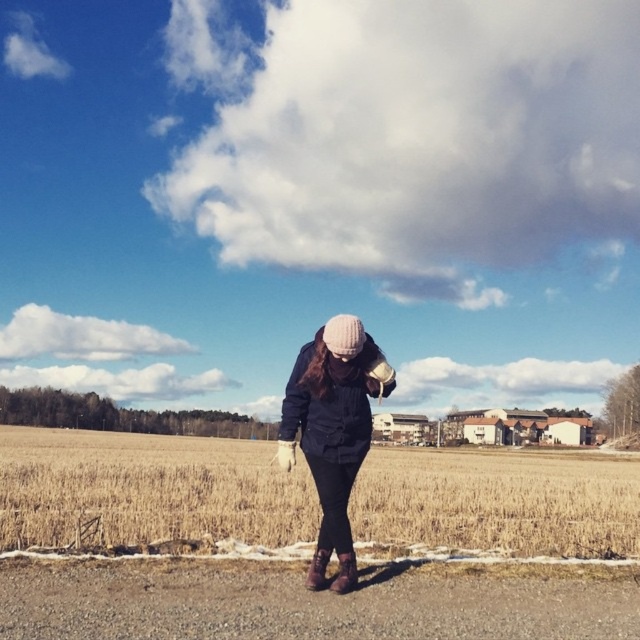
Between brown grass at center and matte black jacket at center, which one is positioned higher?

matte black jacket at center is higher up.

In the scene shown: Is brown grass at center shorter than matte black jacket at center?

Incorrect, brown grass at center's height does not fall short of matte black jacket at center's.

Image resolution: width=640 pixels, height=640 pixels. What do you see at coordinates (147, 490) in the screenshot? I see `brown grass at center` at bounding box center [147, 490].

This screenshot has width=640, height=640. What are the coordinates of `brown grass at center` in the screenshot? It's located at (147, 490).

Is brown grass at center thinner than brown suede boot at lower center?

In fact, brown grass at center might be wider than brown suede boot at lower center.

Is point (216, 477) positioned behind point (337, 589)?

Yes.

Measure the distance between point (499, 468) and camera.

134.57 feet

This screenshot has width=640, height=640. Find the location of `brown grass at center`. brown grass at center is located at coordinates [147, 490].

Does brown suede boot at lower center appear on the left side of brown leather boot at lower center?

No, brown suede boot at lower center is not to the left of brown leather boot at lower center.

Is brown suede boot at lower center further to camera compared to brown leather boot at lower center?

No, brown suede boot at lower center is closer to the viewer.

Who is more forward, [337,576] or [307,572]?

Positioned in front is point [337,576].

Locate an element on the screen. brown suede boot at lower center is located at coordinates (344, 573).